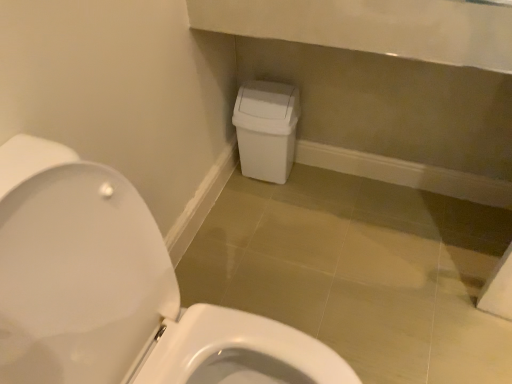
This screenshot has width=512, height=384. I want to click on white glossy toilet at lower left, so click(117, 290).

This screenshot has width=512, height=384. Describe the element at coordinates (117, 290) in the screenshot. I see `white glossy toilet at lower left` at that location.

Locate an element on the screen. The height and width of the screenshot is (384, 512). white glossy toilet at lower left is located at coordinates (117, 290).